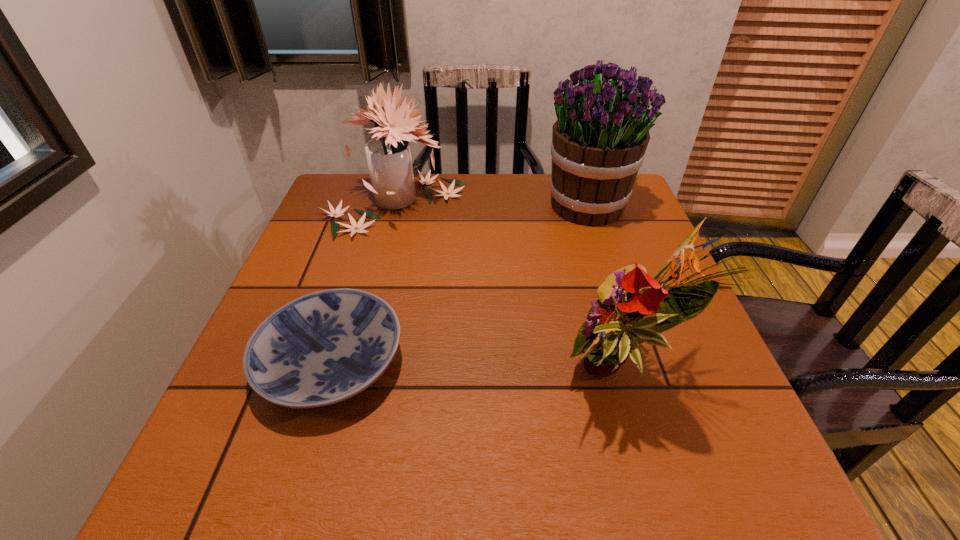
You are a GUI agent. You are given a task and a screenshot of the screen. Output one action in this format:
    pyautogui.click(x=<x>, y=<y>)
    Task: Click on the free spot between the tallest object and the plate
    Image resolution: width=960 pixels, height=540 pixels.
    Given the screenshot: What is the action you would take?
    pyautogui.click(x=460, y=285)

What are the coordinates of `unoccupied position between the leftmost bouquet and the plate` in the screenshot? It's located at (364, 284).

Locate an element on the screen. free spot between the leftmost bouquet and the plate is located at coordinates (364, 284).

You are a GUI agent. You are given a task and a screenshot of the screen. Output one action in this format:
    pyautogui.click(x=<x>, y=<y>)
    Task: Click on the vacant space that is in between the nearest bouquet and the plate
    Image resolution: width=960 pixels, height=540 pixels.
    Given the screenshot: What is the action you would take?
    pyautogui.click(x=477, y=369)

In order to click on free space that is in between the leftmost bouquet and the tallest bouquet in this screenshot , I will do (492, 206).

Where is `vacant space in between the tallest object and the plate`? The width and height of the screenshot is (960, 540). vacant space in between the tallest object and the plate is located at coordinates (460, 285).

Where is `empty space between the leftmost bouquet and the nearest bouquet`? The width and height of the screenshot is (960, 540). empty space between the leftmost bouquet and the nearest bouquet is located at coordinates (509, 290).

Locate an element on the screen. This screenshot has height=540, width=960. free space between the plate and the tallest object is located at coordinates (460, 285).

Identify the location of free space between the leftmost bouquet and the plate. The height and width of the screenshot is (540, 960). pos(364,284).

In order to click on object identified as the third closest to the tallest object in this screenshot , I will do `click(322, 348)`.